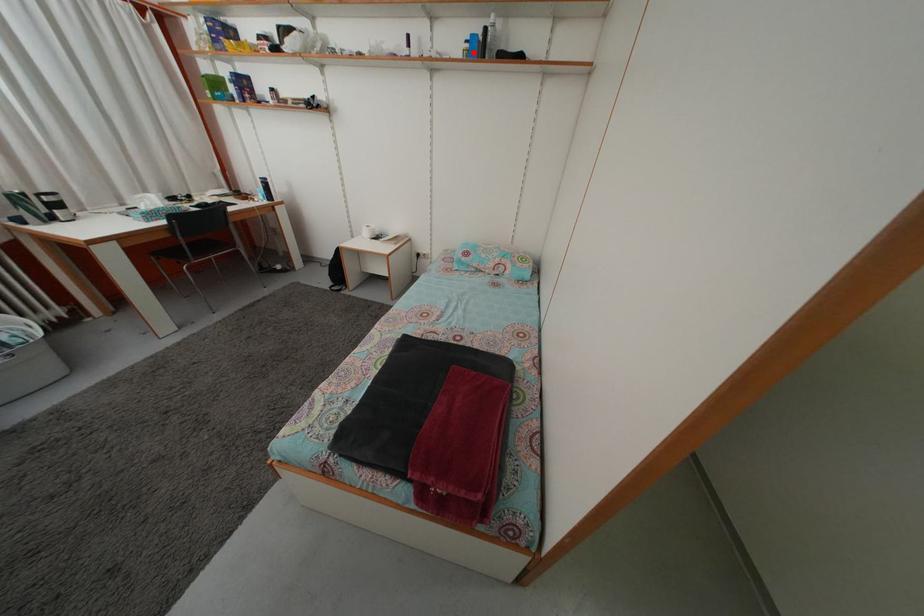
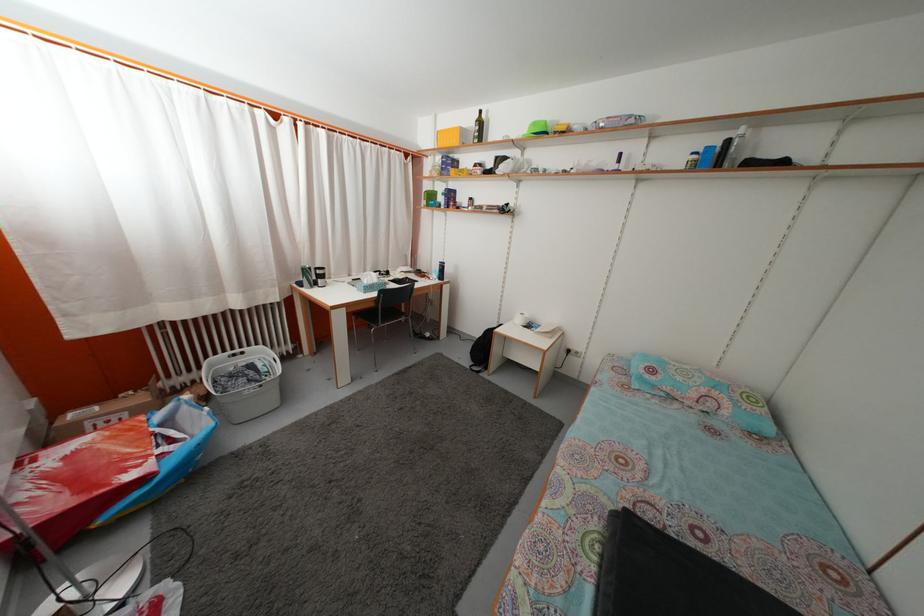
Question: I am providing you with two images of the same scene from different viewpoints. A red point is marked on the first image. At the location where the point appears in image 1, is it still visible in image 2?

Choices:
 (A) Yes
 (B) No

Answer: (A)